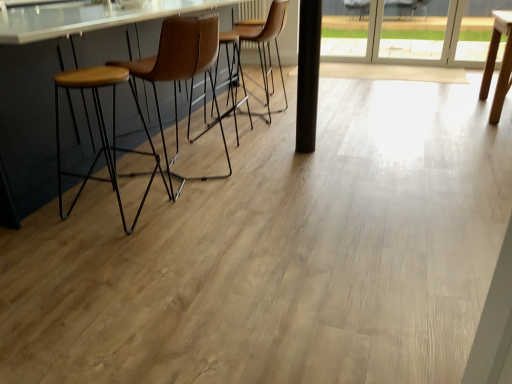
Identify the location of free space in front of brown leather stool at left, the second chair viewed from the back. The image size is (512, 384). (182, 221).